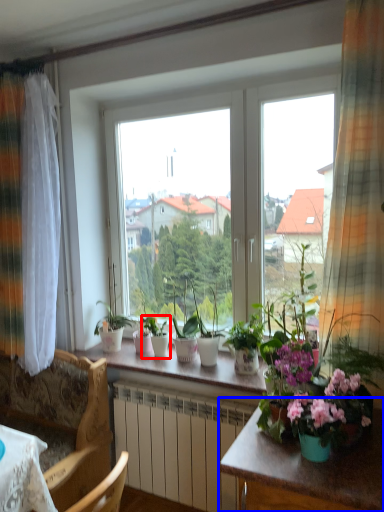
Question: Which of the following is the farthest to the observer, houseplant (highlighted by a red box) or table (highlighted by a blue box)?

Choices:
 (A) houseplant
 (B) table

Answer: (A)